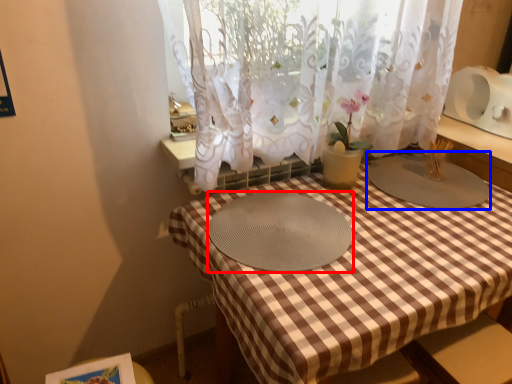
Question: Which point is closer to the camera, glass plate (highlighted by a red box) or glass plate (highlighted by a blue box)?

Choices:
 (A) glass plate
 (B) glass plate

Answer: (A)